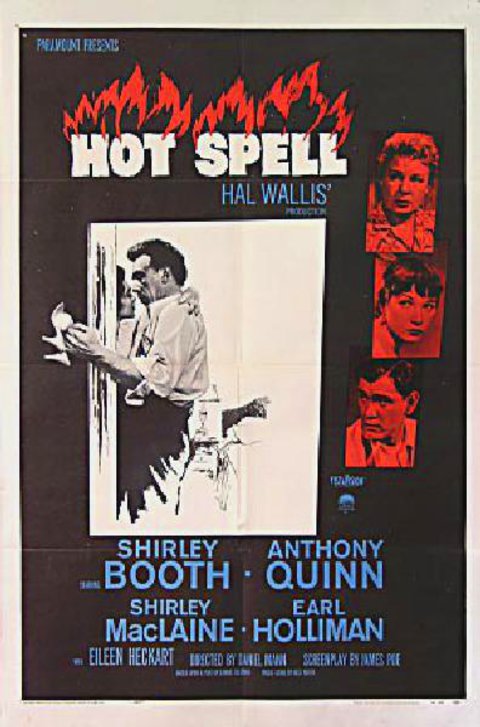
This screenshot has width=480, height=727. I want to click on white wall, so [264, 291].